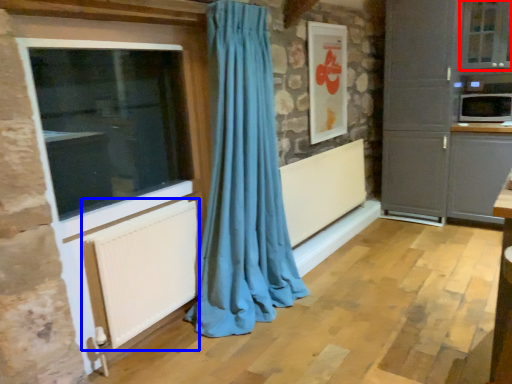
Question: Which point is closer to the camera, window (highlighted by a red box) or radiator (highlighted by a blue box)?

Choices:
 (A) window
 (B) radiator

Answer: (B)